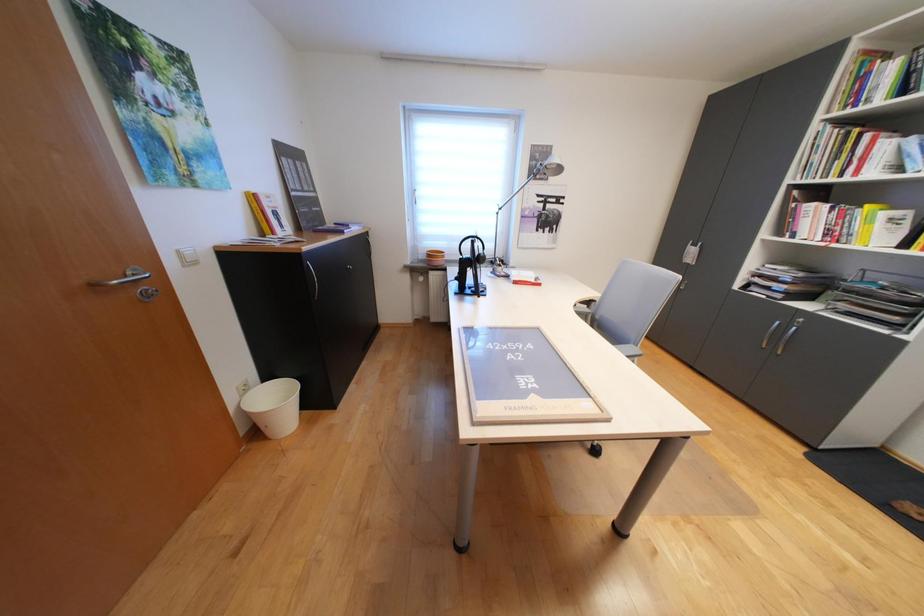
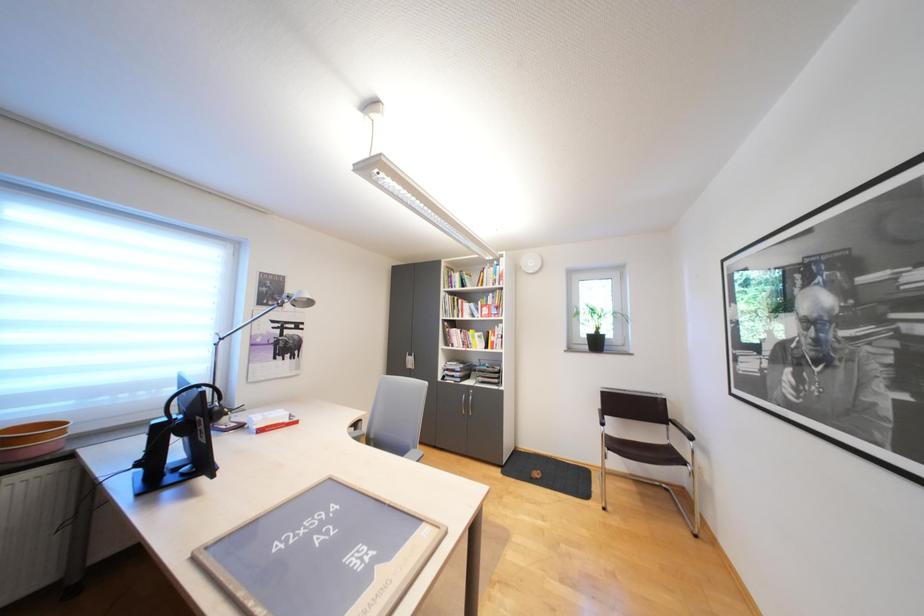
Question: Based on the continuous images, in which direction is the camera rotating? Reply with the corresponding letter.

Choices:
 (A) Left
 (B) Right
 (C) Up
 (D) Down

Answer: (B)